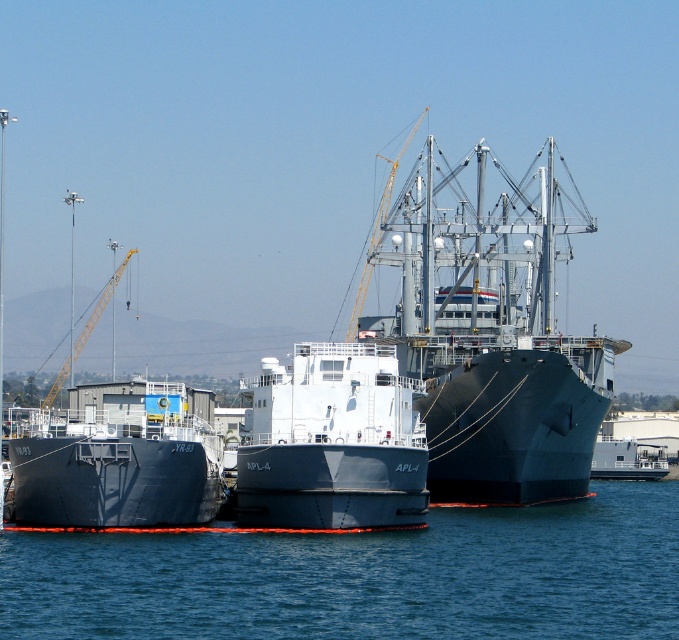
Question: Where is matte gray ship at center located in relation to matte black ship at left in the image?

Choices:
 (A) above
 (B) below

Answer: (A)

Question: Based on their relative distances, which object is farther from the matte black ship at center?

Choices:
 (A) matte black ship at left
 (B) matte gray ship at center
 (C) metallic gray boat at center

Answer: (C)

Question: Which of the following is the farthest from the observer?

Choices:
 (A) (610, 438)
 (B) (568, 369)

Answer: (A)

Question: Does blue water at center come behind matte black ship at center?

Choices:
 (A) yes
 (B) no

Answer: (B)

Question: Among these points, which one is farthest from the camera?

Choices:
 (A) (285, 458)
 (B) (198, 611)

Answer: (A)

Question: Is matte black ship at left wider than metallic gray boat at center?

Choices:
 (A) yes
 (B) no

Answer: (B)